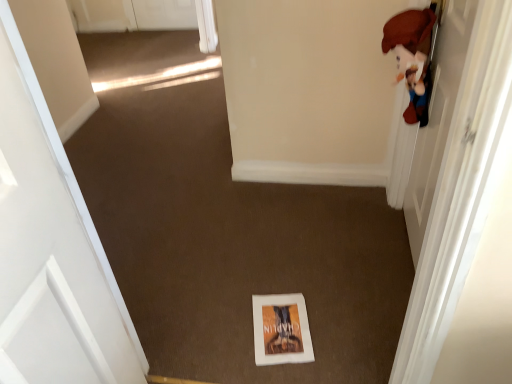
Where is `vacant space behind white glossy door at upper right, positioned as the 2th door in left-to-right order`? vacant space behind white glossy door at upper right, positioned as the 2th door in left-to-right order is located at coordinates (347, 213).